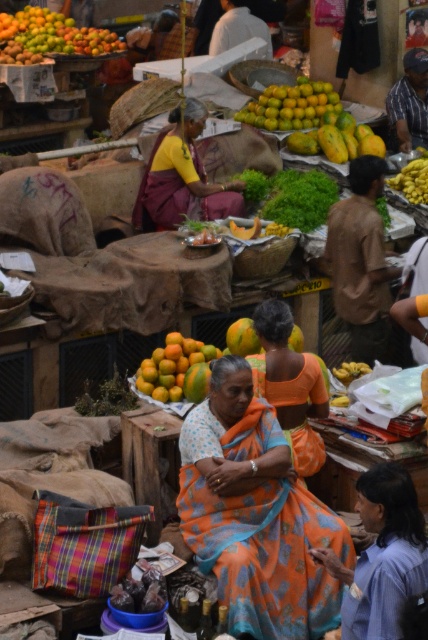
Question: Observing the image, what is the correct spatial positioning of shiny orange fruits at upper left in reference to orange matte at center?

Choices:
 (A) left
 (B) right

Answer: (A)

Question: Among these points, which one is farthest from the camera?

Choices:
 (A) (427, 192)
 (B) (38, 58)
 (C) (169, 220)

Answer: (B)

Question: Which of the following is the closest to the observer?

Choices:
 (A) green leafy at center
 (B) orange fabric saree at center
 (C) shiny orange fruits at upper left
 (D) shiny orange oranges at center

Answer: (B)

Question: Which point is closer to the camera taking this photo?

Choices:
 (A) (424, 172)
 (B) (258, 176)

Answer: (B)

Question: Is matte yellow blouse at center smaller than orange fabric saree at center?

Choices:
 (A) no
 (B) yes

Answer: (A)

Question: In this image, where is orange fabric saree at center located relative to green leafy at center?

Choices:
 (A) right
 (B) left

Answer: (B)